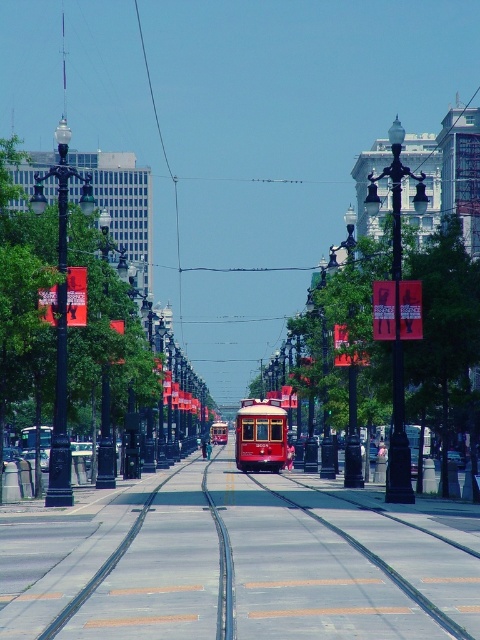
Which is in front, point (323, 563) or point (263, 442)?

Point (323, 563) is in front.

This screenshot has height=640, width=480. What do you see at coordinates (268, 566) in the screenshot?
I see `metallic track at center` at bounding box center [268, 566].

Measure the distance between metallic track at center and camera.

11.54 meters

Locate an element on the screen. The image size is (480, 640). metallic track at center is located at coordinates (268, 566).